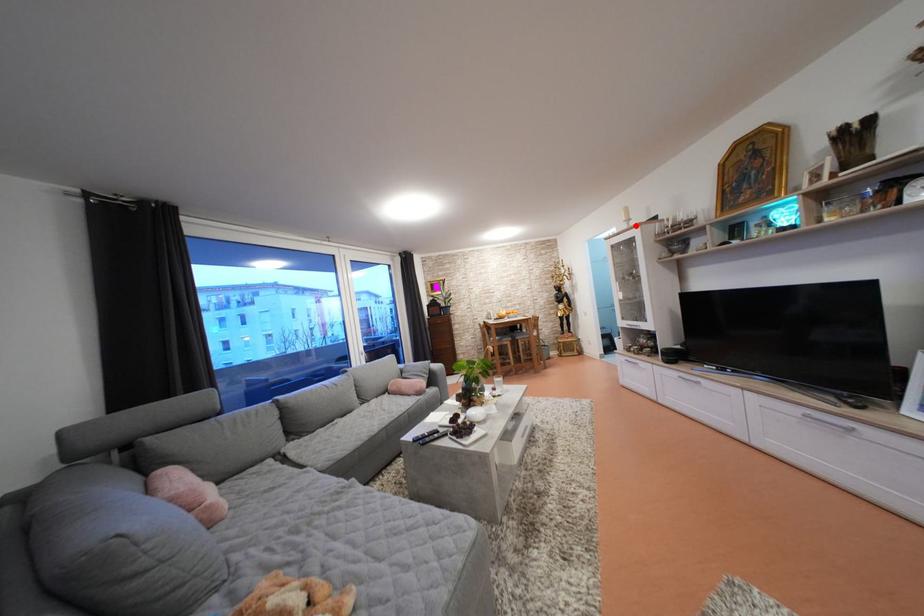
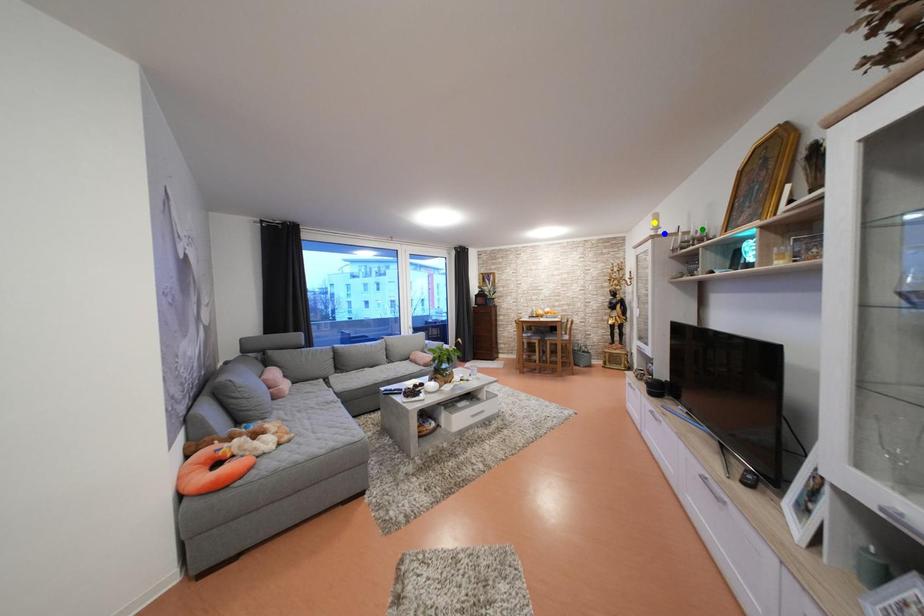
Question: I am providing you with two images of the same scene from different viewpoints. A red point is marked on the first image. You are given multiple points on the second image. Which point in image 2 is actually the same real-world point as the red point in image 1?

Choices:
 (A) green point
 (B) yellow point
 (C) blue point

Answer: (C)